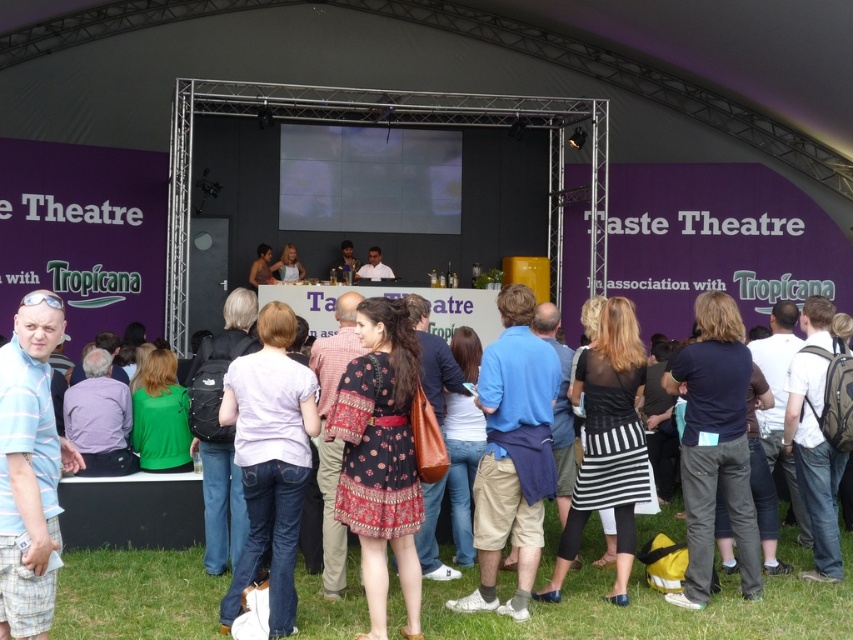
You are a photographer at the Taste Theatre event and need to position yourself so that the light brown hair at center and the metallic silver microphone at center are both visible in your shot. Based on their positions, which side of the microphone should you place the hair to capture both elements effectively?

The light brown hair at center is to the left of the metallic silver microphone at center, so you should position the microphone on the right side of the hair to include both in the shot.